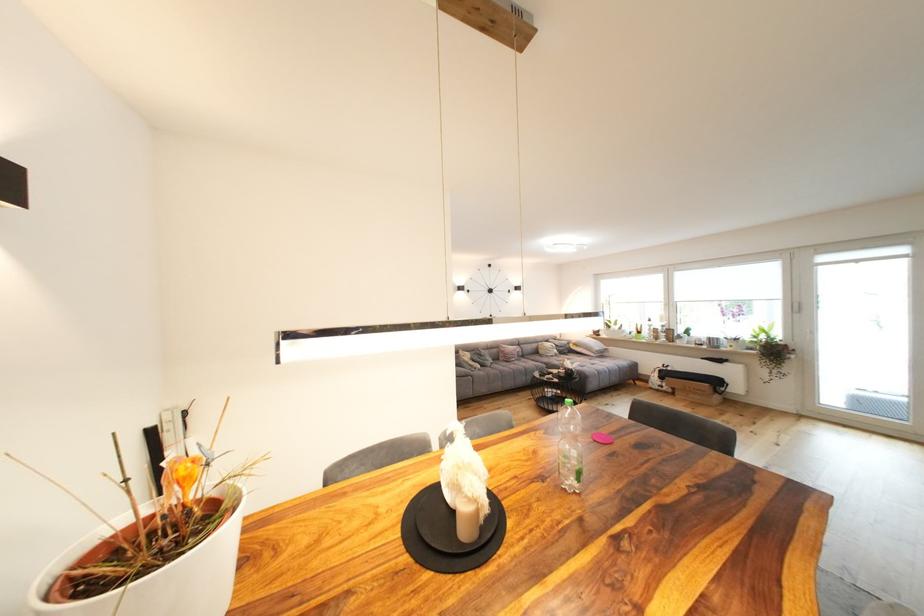
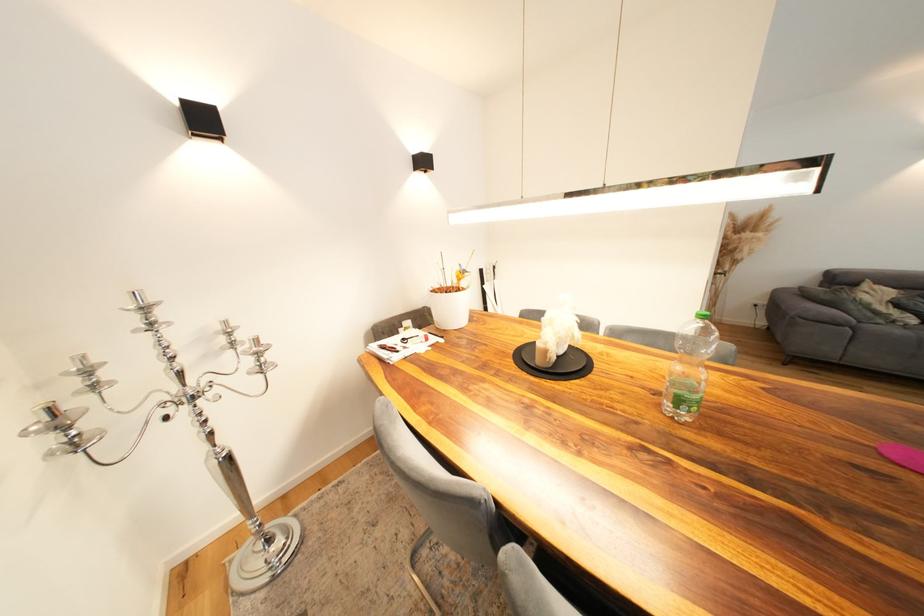
Based on the photo, first-person continuous shooting, in which direction is the camera rotating?

The camera rotated toward left-down.